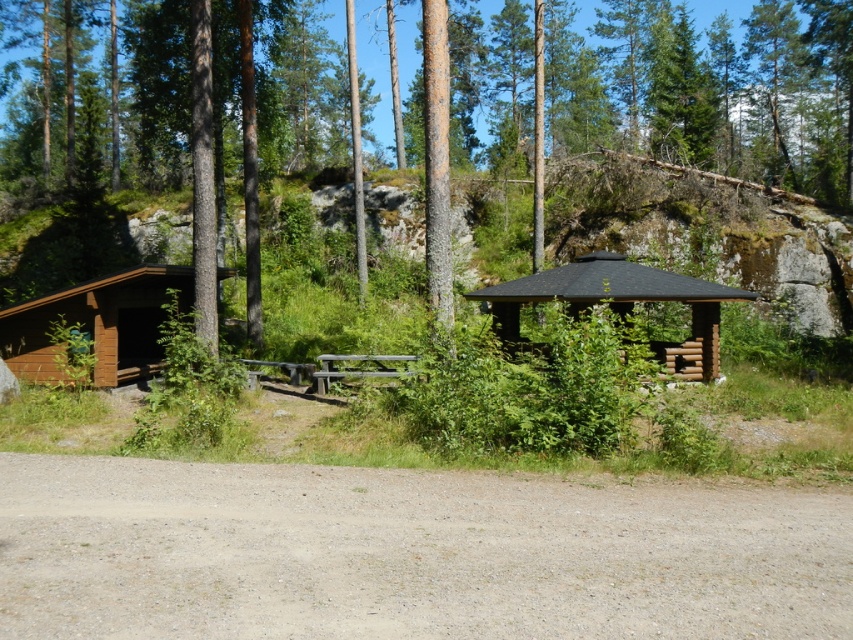
Question: Estimate the real-world distances between objects in this image. Which object is closer to the gray gravel dirt track at lower center?

Choices:
 (A) brown wood tree at center
 (B) brown wooden hut at center

Answer: (B)

Question: Which object is closer to the camera taking this photo?

Choices:
 (A) brown wooden hut at center
 (B) brown wood tree at center
 (C) gray gravel dirt track at lower center

Answer: (C)

Question: Among these points, which one is nearest to the camera?

Choices:
 (A) click(714, 348)
 (B) click(611, 604)

Answer: (B)

Question: Can you confirm if brown wood tree at center is wider than brown wooden hut at center?

Choices:
 (A) no
 (B) yes

Answer: (B)

Question: Does brown wood tree at center appear on the left side of brown wooden hut at center?

Choices:
 (A) yes
 (B) no

Answer: (A)

Question: Can you confirm if brown wood tree at center is smaller than brown wooden hut at center?

Choices:
 (A) yes
 (B) no

Answer: (B)